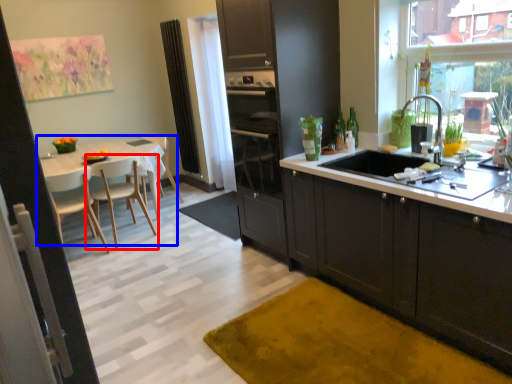
Question: Among these objects, which one is nearest to the camera, chair (highlighted by a red box) or kitchen & dining room table (highlighted by a blue box)?

Choices:
 (A) chair
 (B) kitchen & dining room table

Answer: (B)